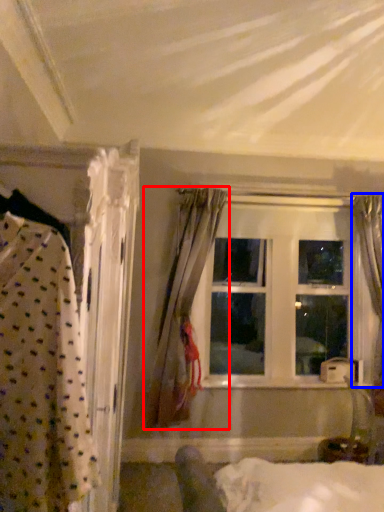
Question: Which object is further to the camera taking this photo, curtain (highlighted by a red box) or curtain (highlighted by a blue box)?

Choices:
 (A) curtain
 (B) curtain

Answer: (B)